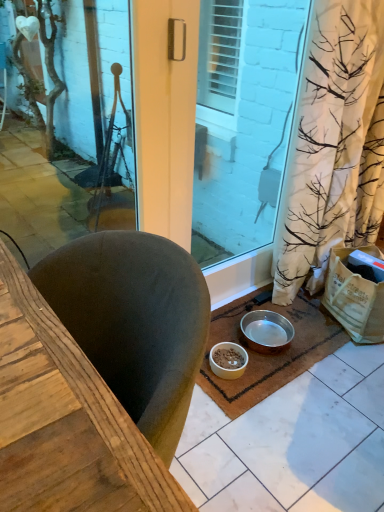
This screenshot has width=384, height=512. Identify the location of vacant space behind metallic silver bowl at lower center, which appears as the 2th bowl when viewed from the left. (259, 308).